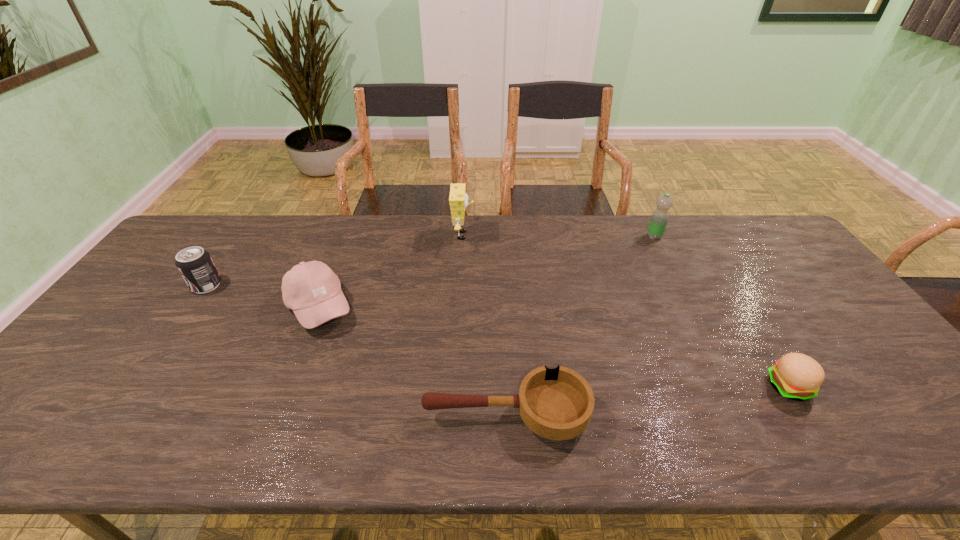
The image size is (960, 540). What are the coordinates of `empty space between the saucepan and the soda can` in the screenshot? It's located at (356, 350).

The height and width of the screenshot is (540, 960). In order to click on vacant area between the rightmost object and the sponge in this screenshot , I will do `click(626, 311)`.

Find the location of a particular element. object that ranks as the second closest to the saucepan is located at coordinates (796, 376).

Locate an element on the screen. The height and width of the screenshot is (540, 960). the third closest object to the soda can is located at coordinates (557, 404).

The image size is (960, 540). Identify the location of vacant region that satisfies the following two spatial constraints: 1. with the handle on the side of the saucepan; 2. on the front-facing side of the fifth object from right to left. (500, 307).

Locate an element on the screen. free point that satisfies the following two spatial constraints: 1. on the front-facing side of the second object from left to right; 2. on the back side of the rightmost object is located at coordinates coord(288,387).

I want to click on free spot that satisfies the following two spatial constraints: 1. with the handle on the side of the saucepan; 2. on the back side of the rightmost object, so click(x=505, y=387).

You are a GUI agent. You are given a task and a screenshot of the screen. Output one action in this format:
    pyautogui.click(x=<x>, y=<y>)
    Task: Click on the vacant space that satisfies the following two spatial constraints: 1. with the handle on the side of the saucepan; 2. on the right side of the rightmost object
    
    Given the screenshot: What is the action you would take?
    pyautogui.click(x=505, y=387)

Where is `vacant area in the image that satisfies the following two spatial constraints: 1. with the handle on the side of the saucepan; 2. on the right side of the rightmost object`? The width and height of the screenshot is (960, 540). vacant area in the image that satisfies the following two spatial constraints: 1. with the handle on the side of the saucepan; 2. on the right side of the rightmost object is located at coordinates (505, 387).

Where is `free location that satisfies the following two spatial constraints: 1. with the handle on the side of the saucepan; 2. on the right side of the fifth object from left to right`? This screenshot has height=540, width=960. free location that satisfies the following two spatial constraints: 1. with the handle on the side of the saucepan; 2. on the right side of the fifth object from left to right is located at coordinates (497, 237).